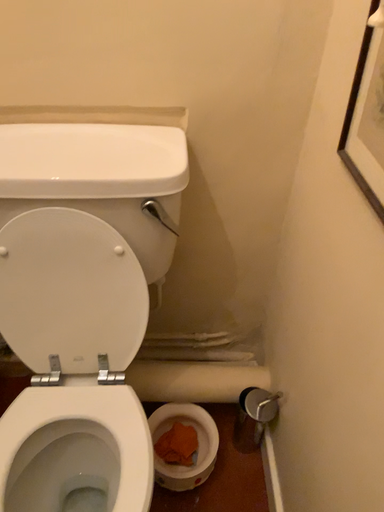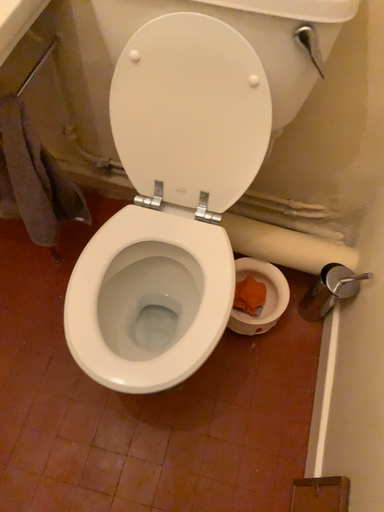
Question: How did the camera likely rotate when shooting the video?

Choices:
 (A) rotated right
 (B) rotated left

Answer: (B)